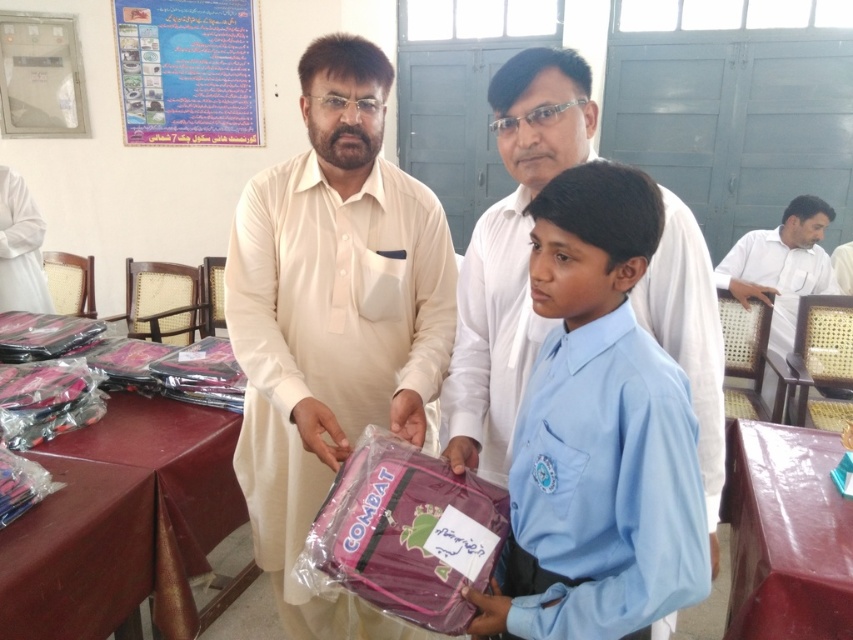
Question: Which object appears farthest from the camera in this image?

Choices:
 (A) maroon fabric table at lower left
 (B) paperboard poster at upper left

Answer: (B)

Question: Does pink matte backpack at center have a lesser width compared to smooth brown table at lower right?

Choices:
 (A) yes
 (B) no

Answer: (A)

Question: Does wooden table at lower left have a larger size compared to white matte shirt at right?

Choices:
 (A) yes
 (B) no

Answer: (B)

Question: Among these points, which one is farthest from the camera?

Choices:
 (A) (144, 531)
 (B) (260, 248)

Answer: (A)

Question: Which point is farther to the camera?

Choices:
 (A) white matte shirt at right
 (B) paperboard poster at upper left

Answer: (B)

Question: Is wooden table at lower left positioned at the back of smooth brown table at lower right?

Choices:
 (A) yes
 (B) no

Answer: (B)